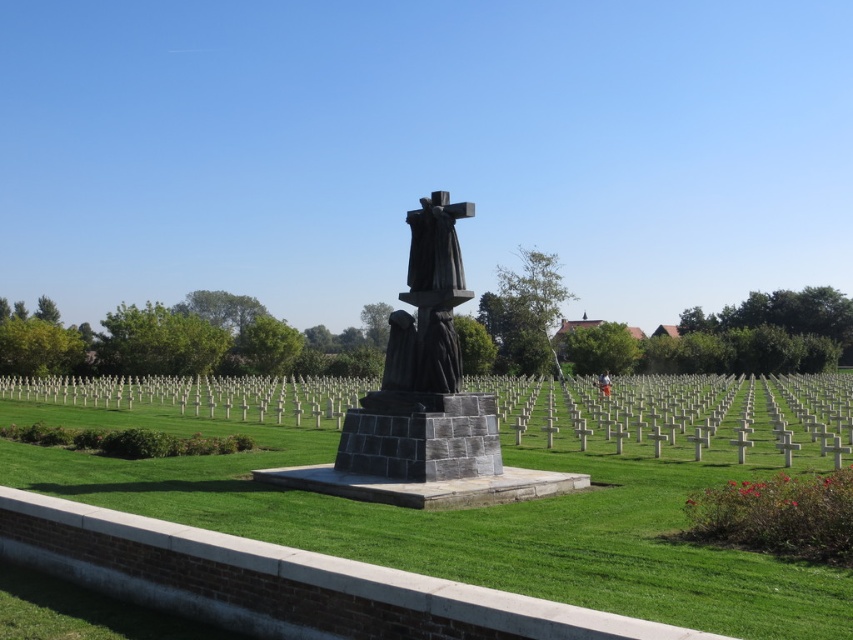
Does dark gray stone sculpture at center have a smaller size compared to light brown wooden stick at center?

Indeed, dark gray stone sculpture at center has a smaller size compared to light brown wooden stick at center.

This screenshot has width=853, height=640. Describe the element at coordinates (424, 372) in the screenshot. I see `dark gray stone sculpture at center` at that location.

Is point (421, 474) farther from camera compared to point (608, 385)?

No, it is in front of (608, 385).

Locate an element on the screen. dark gray stone sculpture at center is located at coordinates (424, 372).

Does dark gray stone statue at center have a greater width compared to light brown wooden stick at center?

Incorrect, dark gray stone statue at center's width does not surpass light brown wooden stick at center's.

Can you confirm if dark gray stone statue at center is positioned to the left of light brown wooden stick at center?

Yes, dark gray stone statue at center is to the left of light brown wooden stick at center.

What do you see at coordinates (428, 301) in the screenshot? I see `dark gray stone statue at center` at bounding box center [428, 301].

I want to click on dark gray stone statue at center, so coord(428,301).

Can you confirm if dark gray stone sculpture at center is positioned below dark gray stone statue at center?

Yes, dark gray stone sculpture at center is below dark gray stone statue at center.

Who is more forward, (350,461) or (422,360)?

Point (350,461) is more forward.

What are the coordinates of `dark gray stone sculpture at center` in the screenshot? It's located at (424, 372).

The width and height of the screenshot is (853, 640). I want to click on dark gray stone sculpture at center, so click(424, 372).